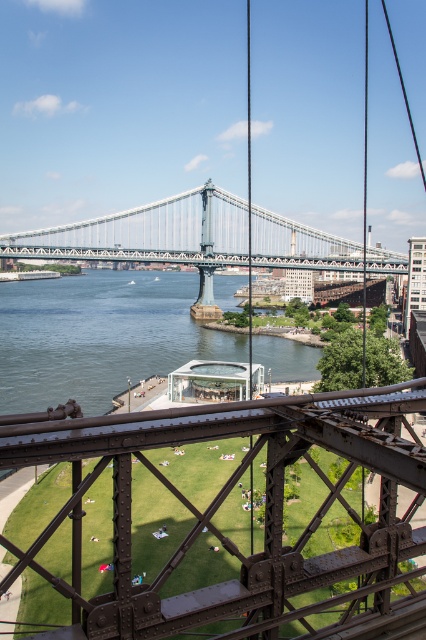
You are standing at the top of the bridge or structure and looking down. There are two points marked on the scene. Which point is closer to you, point (201, 525) or point (238, 248)?

Point (201, 525) is closer to the camera than point (238, 248).

Looking at this image, you are standing on the bridge and want to get to the green grass lawn at center. Which direction should you go from the metallic steel bridge at center?

The green grass lawn at center is to the left of the metallic steel bridge at center, so you should go left from the metallic steel bridge at center to reach it.

You are standing on the bridge and want to take a photo of the green grass lawn at center. Where should you aim your camera to capture it?

The green grass lawn at center is located at coordinates point (226, 497), so aim your camera towards that position to capture it.